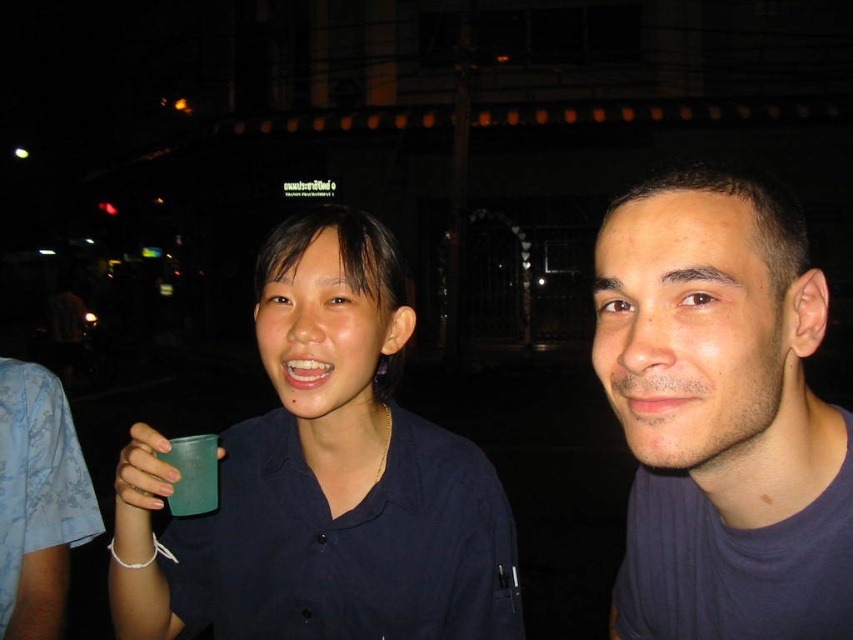
Is dark blue t-shirt at right closer to camera compared to green plastic cup at lower left?

Yes, dark blue t-shirt at right is in front of green plastic cup at lower left.

Is dark blue t-shirt at right positioned behind green plastic cup at lower left?

No, it is in front of green plastic cup at lower left.

The height and width of the screenshot is (640, 853). What are the coordinates of `dark blue t-shirt at right` in the screenshot? It's located at (721, 417).

The width and height of the screenshot is (853, 640). Identify the location of dark blue t-shirt at right. (721, 417).

How much distance is there between matte plastic cup at center and dark blue t-shirt at right?

11.50 inches

Does point (437, 483) lie in front of point (648, 500)?

No.

Measure the distance between point (281, 252) and camera.

Point (281, 252) and camera are 32.79 inches apart from each other.

Find the location of a particular element. This screenshot has width=853, height=640. matte plastic cup at center is located at coordinates (322, 480).

What are the coordinates of `matte plastic cup at center` in the screenshot? It's located at (322, 480).

Is point (383, 492) closer to viewer compared to point (190, 490)?

That is False.

Between point (368, 588) and point (183, 448), which one is positioned in front?

Positioned in front is point (183, 448).

In order to click on matte plastic cup at center in this screenshot , I will do `click(322, 480)`.